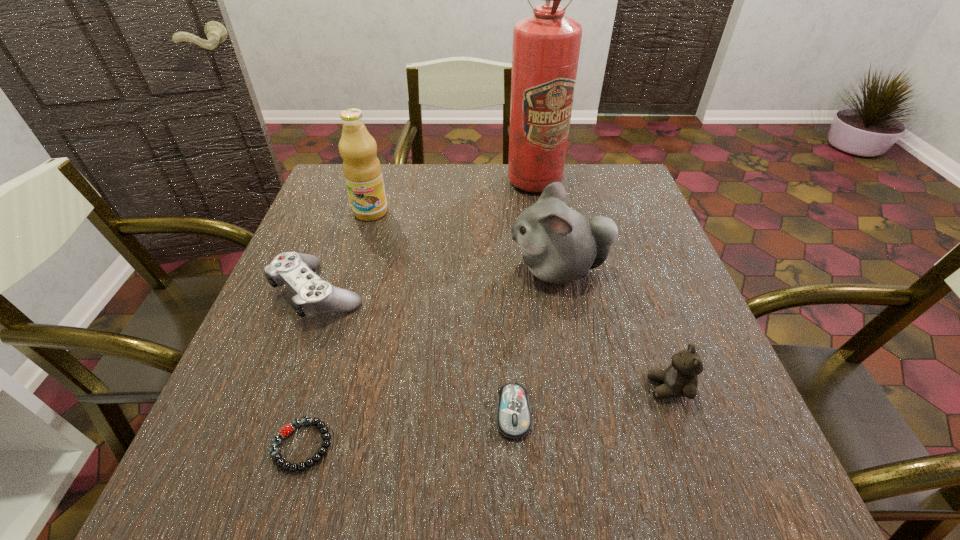
This screenshot has width=960, height=540. Identify the location of vacant space situated 0.060m on the left of the shortest object. (235, 446).

Locate an element on the screen. The width and height of the screenshot is (960, 540). fire extinguisher situated at the far edge is located at coordinates (546, 45).

The height and width of the screenshot is (540, 960). What are the coordinates of `olive oil that is at the far edge` in the screenshot? It's located at [362, 170].

The image size is (960, 540). I want to click on object present at the near edge, so click(324, 430).

This screenshot has width=960, height=540. I want to click on olive oil that is at the left edge, so click(x=362, y=170).

In order to click on control that is positioned at the left edge in this screenshot , I will do `click(313, 296)`.

Where is `bracelet that is at the left edge`? This screenshot has height=540, width=960. bracelet that is at the left edge is located at coordinates (324, 430).

Find the location of a particular element. Image resolution: width=960 pixels, height=540 pixels. hamster that is positioned at the right edge is located at coordinates (559, 245).

Image resolution: width=960 pixels, height=540 pixels. I want to click on teddy bear present at the right edge, so pyautogui.click(x=680, y=379).

Locate an element on the screen. The image size is (960, 540). object located at the far left corner is located at coordinates (362, 170).